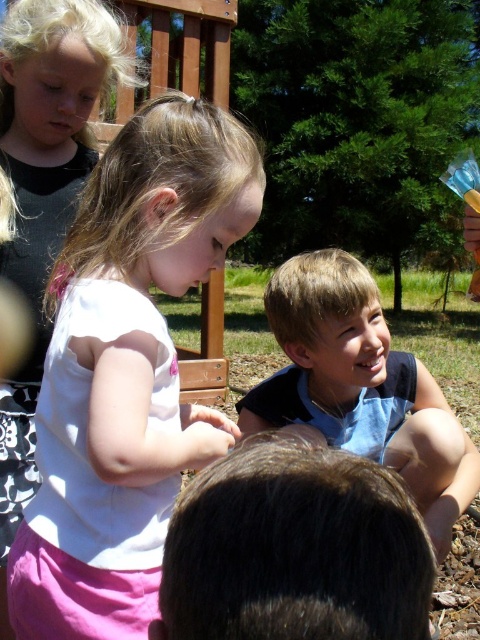
Does white matte shirt at center have a lesser width compared to white matte shirt at upper left?

In fact, white matte shirt at center might be wider than white matte shirt at upper left.

Does white matte shirt at center appear on the right side of white matte shirt at upper left?

Indeed, white matte shirt at center is positioned on the right side of white matte shirt at upper left.

Image resolution: width=480 pixels, height=640 pixels. Find the location of `white matte shirt at center`. white matte shirt at center is located at coordinates (129, 365).

Between blue cotton shirt at lower right and white matte shirt at upper left, which one has more height?

white matte shirt at upper left

Does blue cotton shirt at lower right have a greater width compared to white matte shirt at upper left?

Indeed, blue cotton shirt at lower right has a greater width compared to white matte shirt at upper left.

Is point (297, 289) behind point (68, 115)?

Yes, point (297, 289) is behind point (68, 115).

The image size is (480, 640). What are the coordinates of `blue cotton shirt at lower right` in the screenshot? It's located at (360, 387).

How distant is white matte shirt at center from brown hair at lower center?

white matte shirt at center and brown hair at lower center are 20.73 inches apart from each other.

Is white matte shirt at center bigger than brown hair at lower center?

Indeed, white matte shirt at center has a larger size compared to brown hair at lower center.

Which is behind, point (31, 625) or point (391, 576)?

The point (31, 625) is behind.

The image size is (480, 640). Find the location of `white matte shirt at center`. white matte shirt at center is located at coordinates (129, 365).